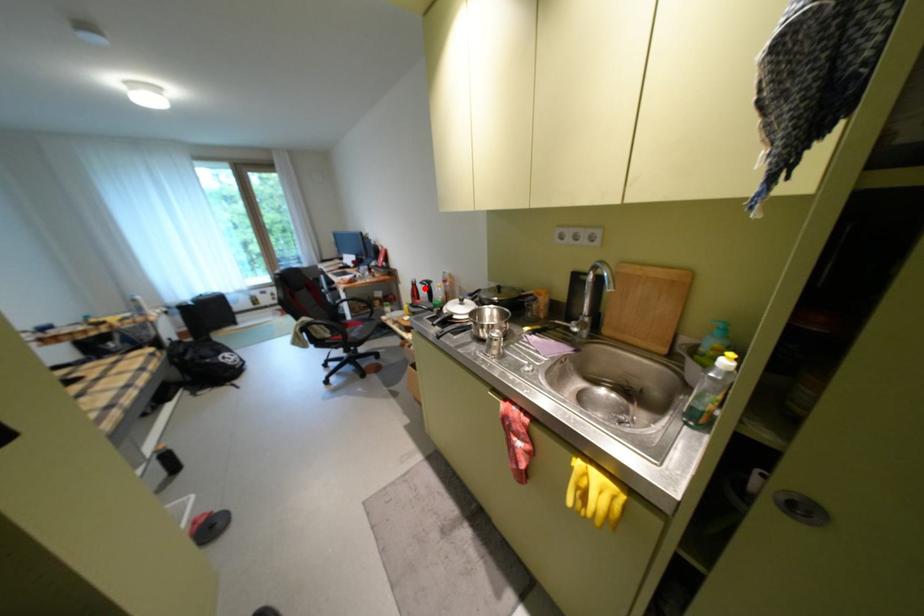
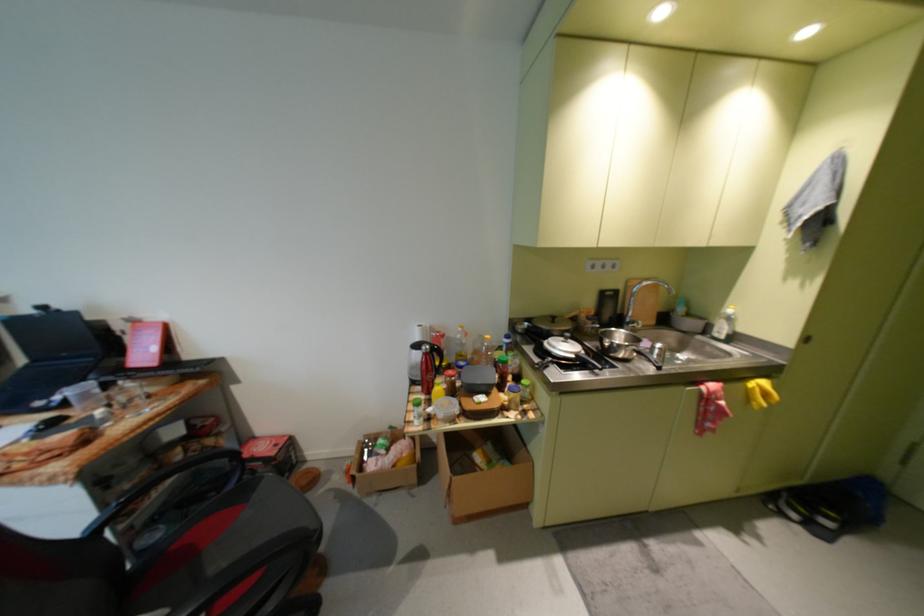
Locate, in the second image, the point that corresponds to the highlighted location in the first image.

(439, 358)